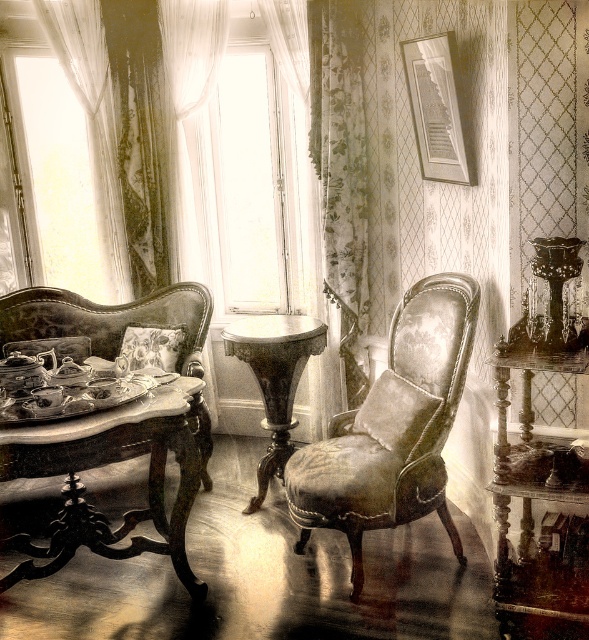
Question: Is white sheer curtain at left bigger than wooden polished table at center?

Choices:
 (A) yes
 (B) no

Answer: (A)

Question: Which of these objects is positioned farthest from the floral fabric curtain at upper right?

Choices:
 (A) velvet-like beige armchair at center
 (B) white sheer curtain at left
 (C) transparent glass window at center

Answer: (B)

Question: Is white sheer curtain at left bigger than transparent glass window at center?

Choices:
 (A) yes
 (B) no

Answer: (A)

Question: Does white sheer curtain at left have a lesser width compared to marble pedestal table at center?

Choices:
 (A) no
 (B) yes

Answer: (A)

Question: Which is nearer to the floral fabric curtain at upper right?

Choices:
 (A) marble pedestal table at center
 (B) wooden polished table at center
 (C) transparent glass window at center
 (D) velvet-like beige armchair at center

Answer: (C)

Question: Among these objects, which one is nearest to the camera?

Choices:
 (A) floral fabric curtain at upper right
 (B) wooden polished table at center
 (C) transparent glass window at center

Answer: (B)